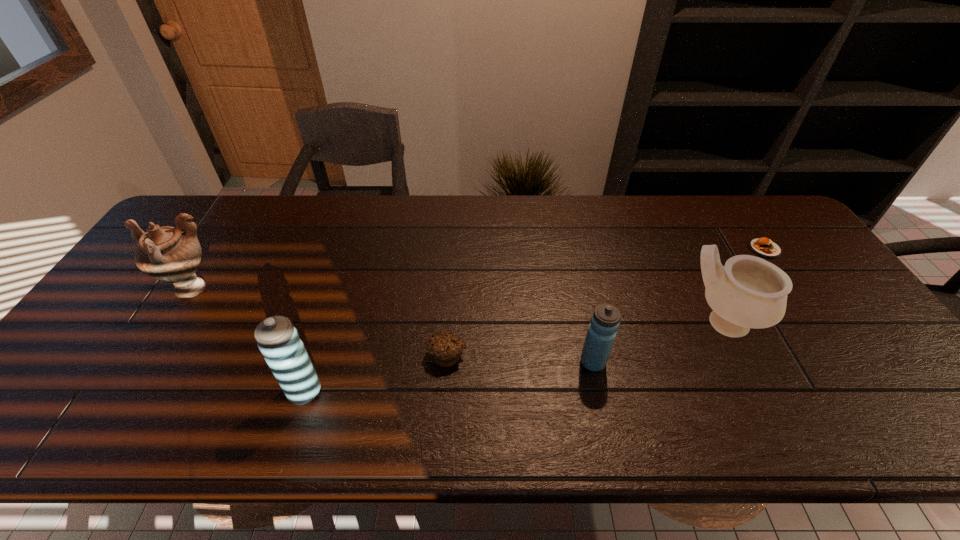
Please point a spot to add another water bottle on the right. Please provide its 2D coordinates. Your answer should be formatted as a tuple, i.e. [(x, y)], where the tuple contains the x and y coordinates of a point satisfying the conditions above.

[(852, 336)]